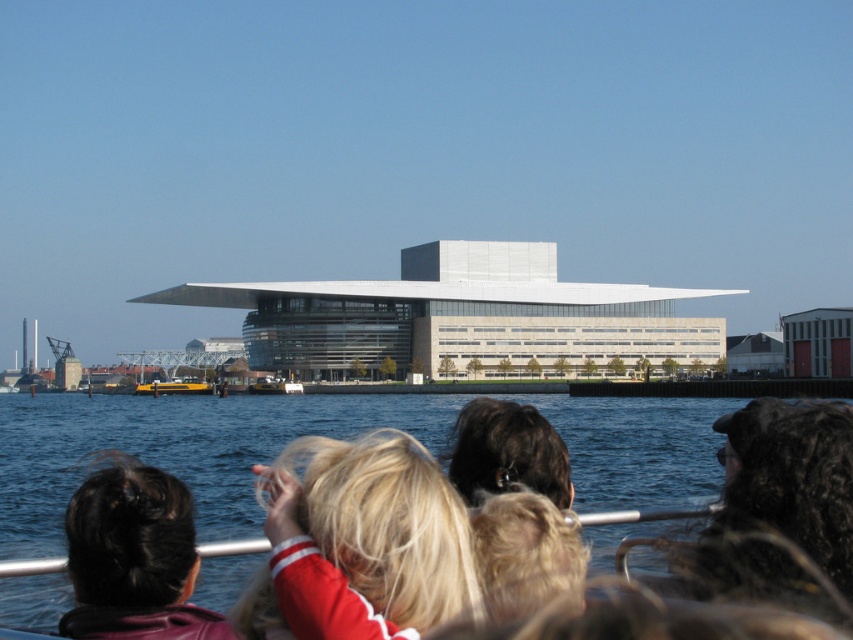
Question: Is blue water at lower left in front of black fur at center?

Choices:
 (A) no
 (B) yes

Answer: (B)

Question: Which point is farther to the camera?

Choices:
 (A) yellow rubber boat at lower left
 (B) dark brown hair at lower left

Answer: (A)

Question: Among these points, which one is farthest from the camera?

Choices:
 (A) (163, 392)
 (B) (634, 499)
 (C) (293, 384)

Answer: (A)

Question: Considering the relative positions of blonde hair at center and dark brown hair at lower left in the image provided, where is blonde hair at center located with respect to dark brown hair at lower left?

Choices:
 (A) below
 (B) above

Answer: (B)

Question: Does dark curly hair at upper right have a lesser width compared to yellow rubber boat at lower left?

Choices:
 (A) yes
 (B) no

Answer: (A)

Question: Which of the following is the closest to the observer?

Choices:
 (A) (817, 541)
 (B) (560, 472)
 (C) (157, 381)
 (D) (102, 596)

Answer: (D)